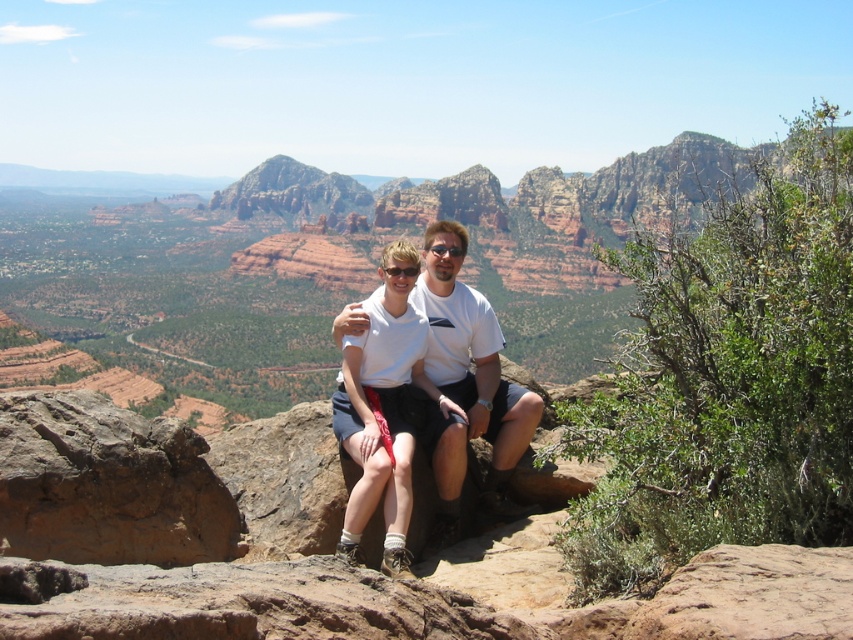
Where is `brown rough rock at lower left`? brown rough rock at lower left is located at coordinates (107, 484).

Can you confirm if brown rough rock at lower left is smaller than white cotton shirt at center?

Yes.

What do you see at coordinates (107, 484) in the screenshot? The image size is (853, 640). I see `brown rough rock at lower left` at bounding box center [107, 484].

Image resolution: width=853 pixels, height=640 pixels. I want to click on brown rough rock at lower left, so click(x=107, y=484).